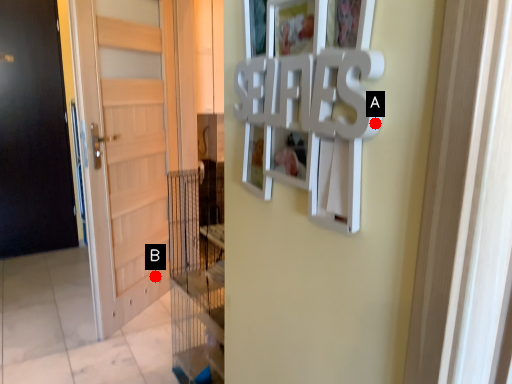
Question: Two points are circled on the image, labeled by A and B beside each circle. Which point is closer to the camera taking this photo?

Choices:
 (A) A is closer
 (B) B is closer

Answer: (A)